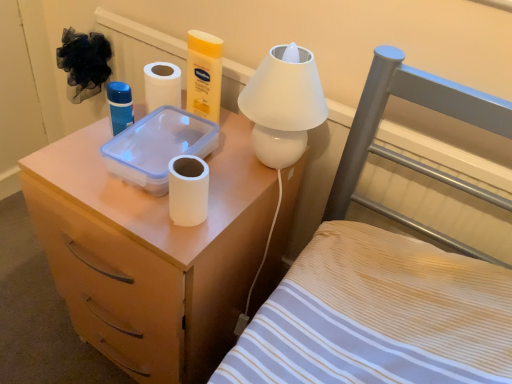
Question: From the image's perspective, is wooden nightstand at center-left above or below white matte toilet paper at center?

Choices:
 (A) below
 (B) above

Answer: (B)

Question: Based on their sizes in the image, would you say wooden nightstand at center-left is bigger or smaller than white matte toilet paper at center?

Choices:
 (A) small
 (B) big

Answer: (B)

Question: Which is nearer to the wooden nightstand at center-left?

Choices:
 (A) white matte toilet paper at center
 (B) matte plastic container at upper center
 (C) white glossy table lamp at upper center

Answer: (C)

Question: Which object is the closest to the matte plastic container at upper center?

Choices:
 (A) white glossy table lamp at upper center
 (B) white matte toilet paper at center
 (C) wooden nightstand at center-left

Answer: (B)